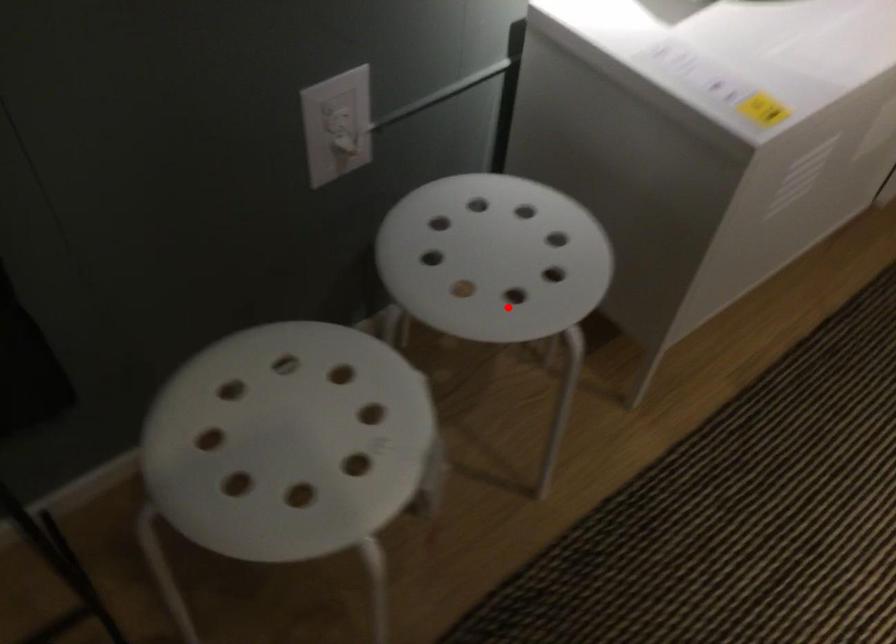
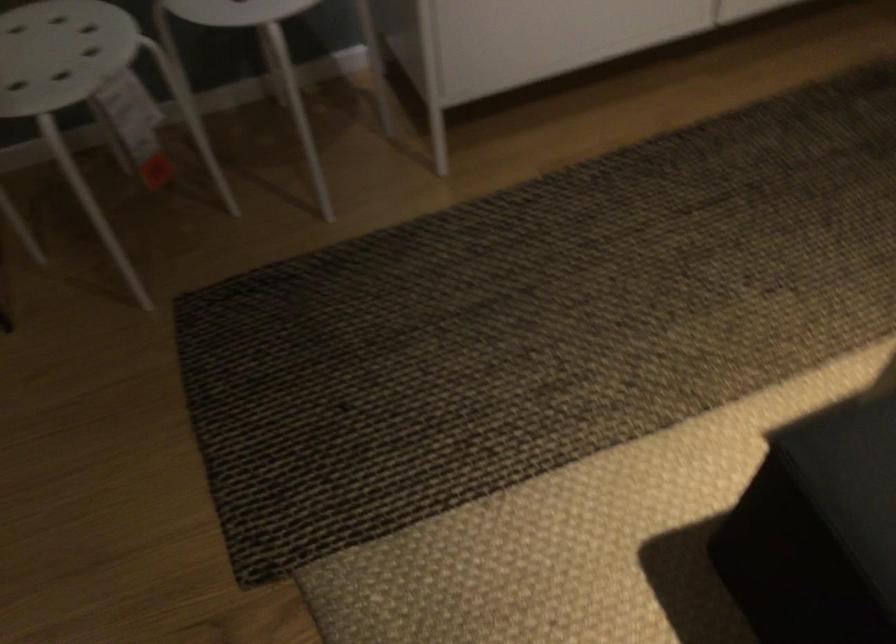
Question: I am providing you with two images of the same scene from different viewpoints. In image1, a red point is highlighted. Considering the same 3D point in image2, which of the following is correct?

Choices:
 (A) It is closer
 (B) It is farther

Answer: (B)